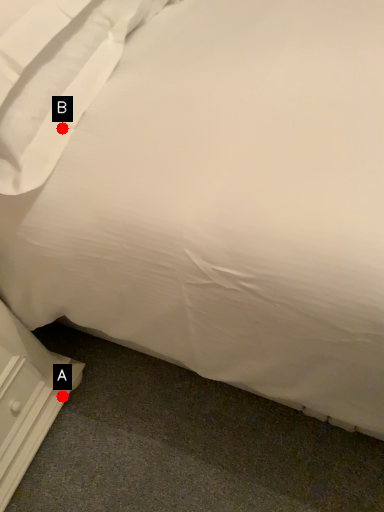
Question: Two points are circled on the image, labeled by A and B beside each circle. Which point is further to the camera?

Choices:
 (A) A is further
 (B) B is further

Answer: (A)